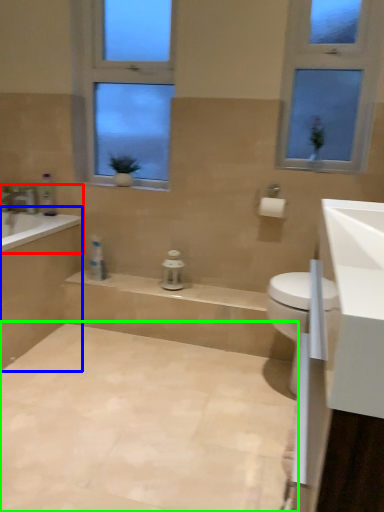
Question: Which object is the farthest from bathtub (highlighted by a red box)? Choose among these: bath (highlighted by a blue box) or plain (highlighted by a green box).

Choices:
 (A) bath
 (B) plain

Answer: (B)